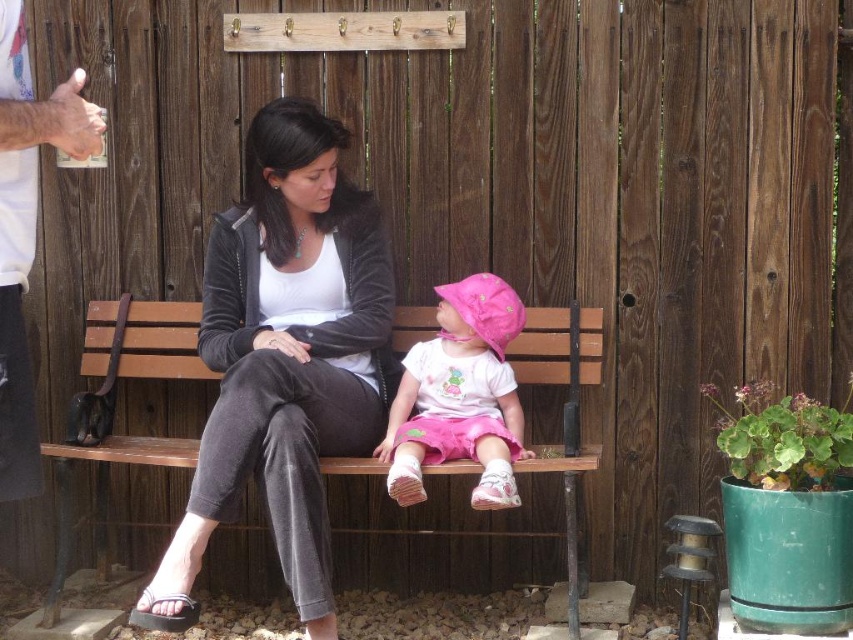
Question: Which of these objects is positioned closest to the gray fabric sandal at lower left?

Choices:
 (A) white t-shirt at upper left
 (B) pink fabric hat at center

Answer: (A)

Question: Which point is closer to the camera?

Choices:
 (A) (26, 45)
 (B) (135, 608)
 (C) (523, 365)

Answer: (A)

Question: Which point is farther to the camera?

Choices:
 (A) pink fabric hat at center
 (B) velvet black jacket at center
 (C) wooden bench at center
 (D) black fabric pants at center

Answer: (C)

Question: Can you confirm if velvet black jacket at center is smaller than wooden bench at center?

Choices:
 (A) no
 (B) yes

Answer: (A)

Question: Is velvet black jacket at center thinner than pink fabric hat at center?

Choices:
 (A) no
 (B) yes

Answer: (A)

Question: Observing the image, what is the correct spatial positioning of velvet black jacket at center in reference to white t-shirt at upper left?

Choices:
 (A) below
 (B) above

Answer: (A)